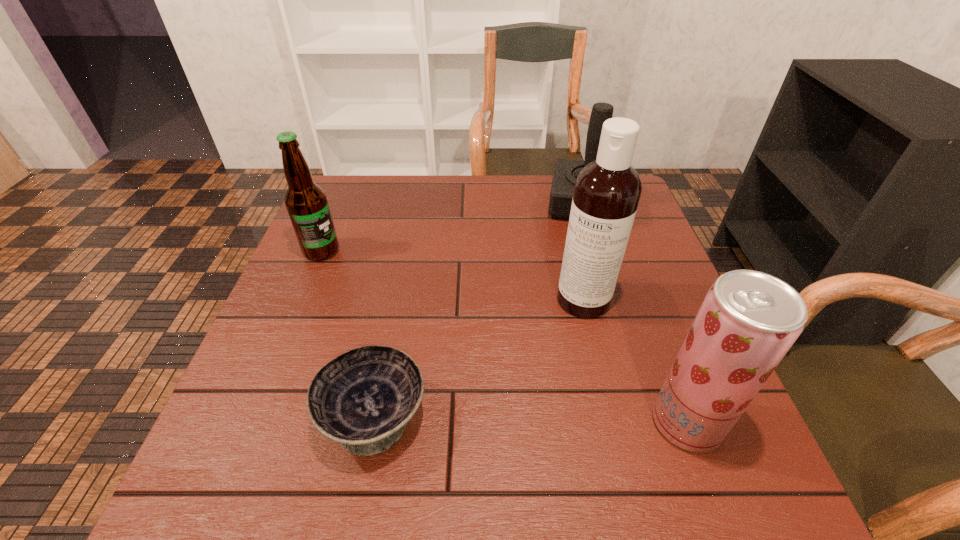
Image resolution: width=960 pixels, height=540 pixels. Identify the location of the shortest object. (363, 399).

Find the location of a particular element. The width and height of the screenshot is (960, 540). bowl is located at coordinates (363, 399).

Locate an element on the screen. fruit juice is located at coordinates (748, 321).

Identify the location of the third nearest object. (607, 191).

I want to click on dishwasher detergent, so click(607, 191).

Where is `the farthest object`? Image resolution: width=960 pixels, height=540 pixels. the farthest object is located at coordinates (566, 171).

In order to click on the fourth nearest object in this screenshot , I will do `click(306, 202)`.

In order to click on the leftmost object in this screenshot , I will do `click(306, 202)`.

Where is `vacant space located on the back of the bowl`? vacant space located on the back of the bowl is located at coordinates (396, 305).

Where is `vacant space positioned on the back of the fruit juice`? vacant space positioned on the back of the fruit juice is located at coordinates (657, 342).